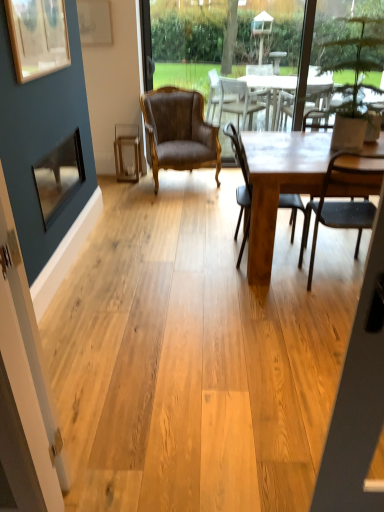
Where is `free location in front of matte brown chair at center, which is the 2th chair from right to left`? Image resolution: width=384 pixels, height=512 pixels. free location in front of matte brown chair at center, which is the 2th chair from right to left is located at coordinates (252, 296).